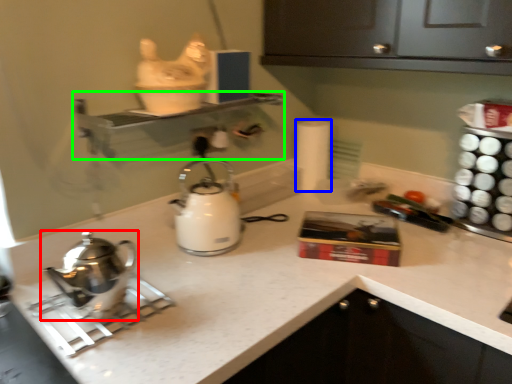
Question: Considering the real-world distances, which object is closest to kettle (highlighted by a red box)? toilet paper (highlighted by a blue box) or shelf (highlighted by a green box).

Choices:
 (A) toilet paper
 (B) shelf

Answer: (B)